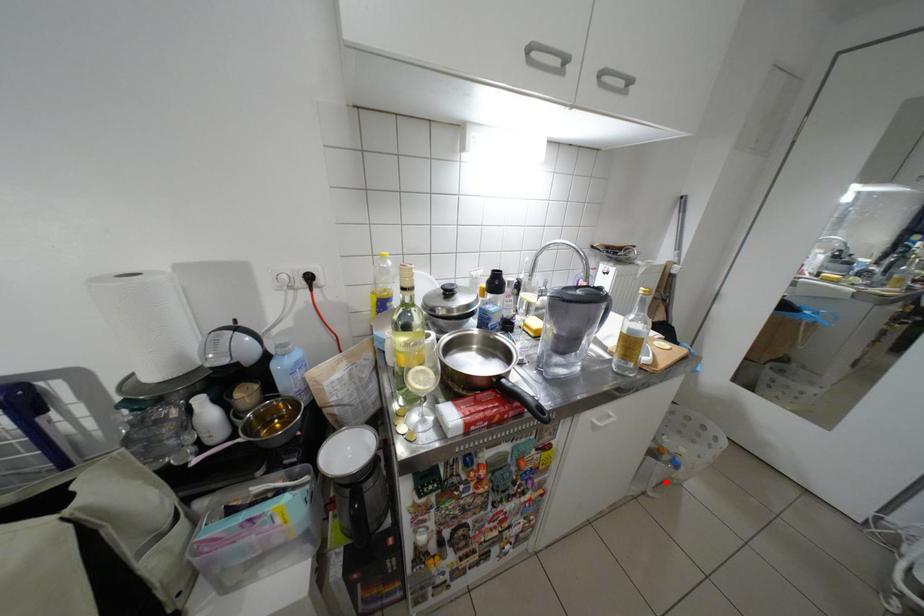
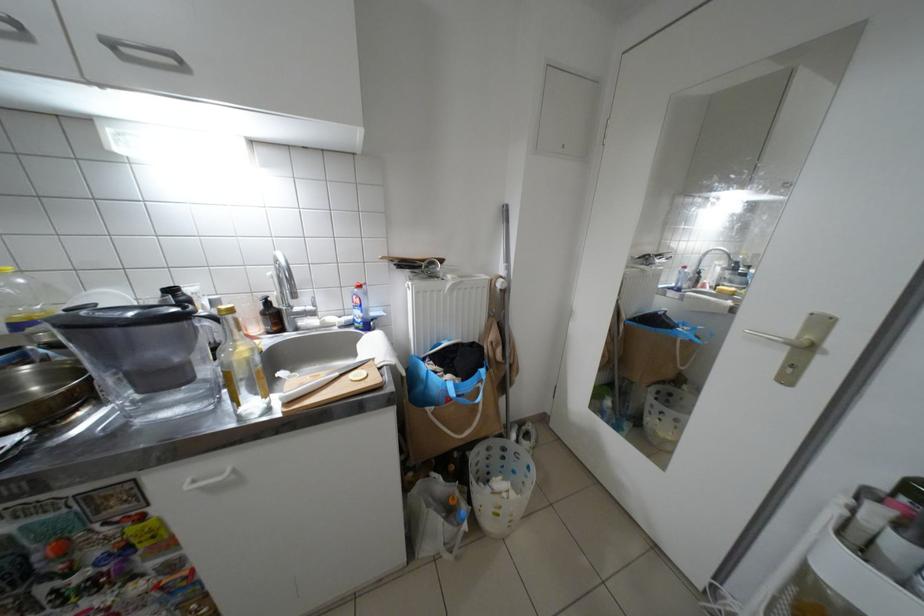
Where in the second image is the point corresponding to the highlighted location from the first image?

(453, 541)